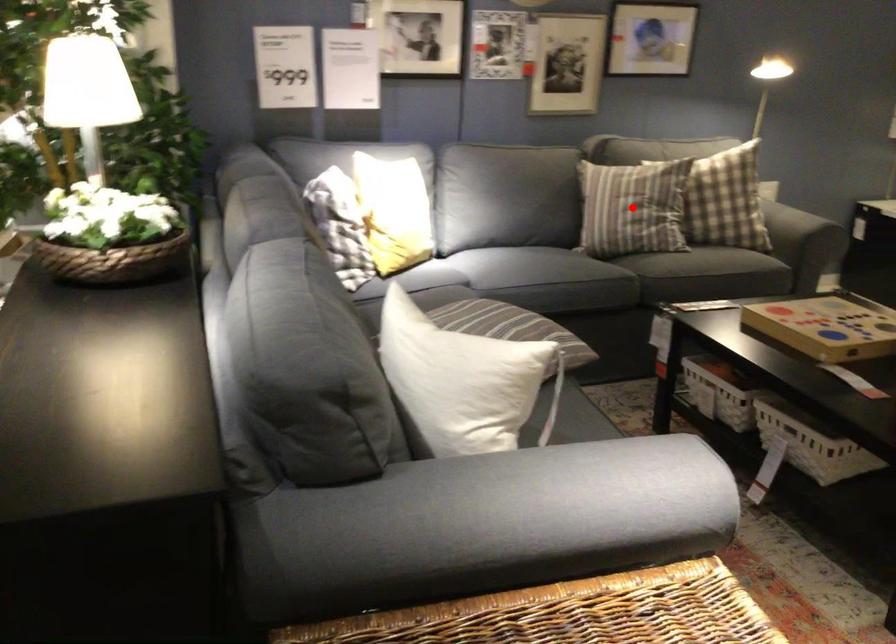
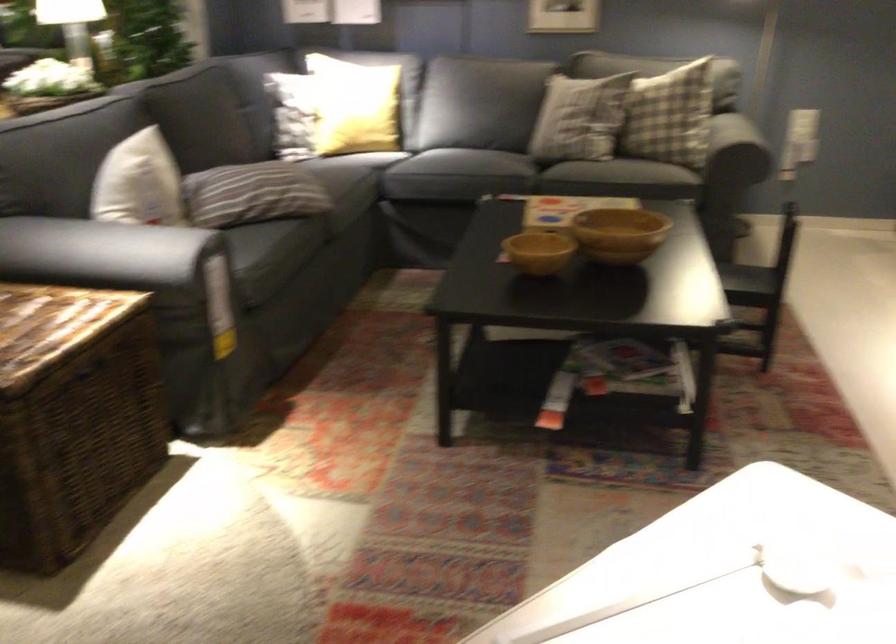
Question: I am providing you with two images of the same scene from different viewpoints. A red point is marked on the first image. Can you still see the location of the red point in image 2?

Choices:
 (A) Yes
 (B) No

Answer: (B)